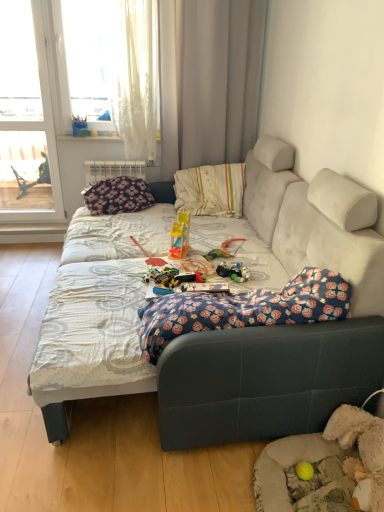
Question: Does white fabric curtain at upper center have a lesser height compared to white sheer curtain at upper left, which ranks as the second window in left-to-right order?

Choices:
 (A) yes
 (B) no

Answer: (B)

Question: Considering the relative sizes of white fabric curtain at upper center and white sheer curtain at upper left, which appears as the 1th window when viewed from the right, in the image provided, is white fabric curtain at upper center wider than white sheer curtain at upper left, which appears as the 1th window when viewed from the right,?

Choices:
 (A) no
 (B) yes

Answer: (B)

Question: Is white fabric curtain at upper center smaller than white sheer curtain at upper left, which appears as the 1th window when viewed from the right?

Choices:
 (A) no
 (B) yes

Answer: (A)

Question: Considering the relative sizes of white fabric curtain at upper center and white sheer curtain at upper left, which ranks as the second window in left-to-right order, in the image provided, is white fabric curtain at upper center bigger than white sheer curtain at upper left, which ranks as the second window in left-to-right order,?

Choices:
 (A) yes
 (B) no

Answer: (A)

Question: From a real-world perspective, is white fabric curtain at upper center beneath white sheer curtain at upper left, which ranks as the second window in left-to-right order?

Choices:
 (A) no
 (B) yes

Answer: (B)

Question: Is white fabric curtain at upper center oriented towards white sheer curtain at upper left, which appears as the 1th window when viewed from the right?

Choices:
 (A) yes
 (B) no

Answer: (B)

Question: Is white fabric curtain at upper center aimed at translucent plastic slide at center, the 1th toy when ordered from back to front?

Choices:
 (A) no
 (B) yes

Answer: (B)

Question: Is white fabric curtain at upper center far from translucent plastic slide at center, which is counted as the second toy, starting from the front?

Choices:
 (A) yes
 (B) no

Answer: (A)

Question: From the image's perspective, does white fabric curtain at upper center appear higher than translucent plastic slide at center, the second toy ordered from the bottom?

Choices:
 (A) no
 (B) yes

Answer: (B)

Question: Does white fabric curtain at upper center appear on the right side of translucent plastic slide at center, acting as the first toy starting from the top?

Choices:
 (A) no
 (B) yes

Answer: (B)

Question: Considering the relative positions of white fabric curtain at upper center and translucent plastic slide at center, placed as the 2th toy when sorted from right to left, in the image provided, is white fabric curtain at upper center behind translucent plastic slide at center, placed as the 2th toy when sorted from right to left,?

Choices:
 (A) yes
 (B) no

Answer: (A)

Question: Is white fabric curtain at upper center in front of translucent plastic slide at center, acting as the first toy starting from the left?

Choices:
 (A) yes
 (B) no

Answer: (B)

Question: Is the depth of translucent plastic toy at center less than that of floral fabric blanket at center?

Choices:
 (A) no
 (B) yes

Answer: (A)